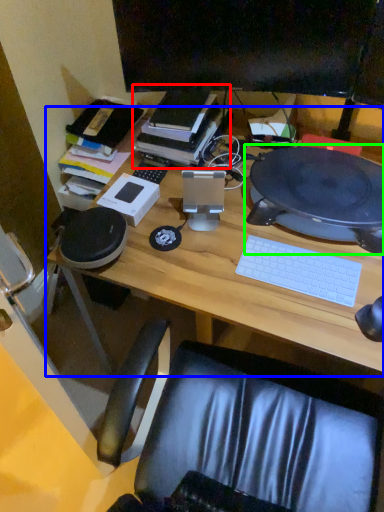
Question: Which object is positioned farthest from book (highlighted by a red box)? Select from desk (highlighted by a blue box) and computer (highlighted by a green box).

Choices:
 (A) desk
 (B) computer

Answer: (B)